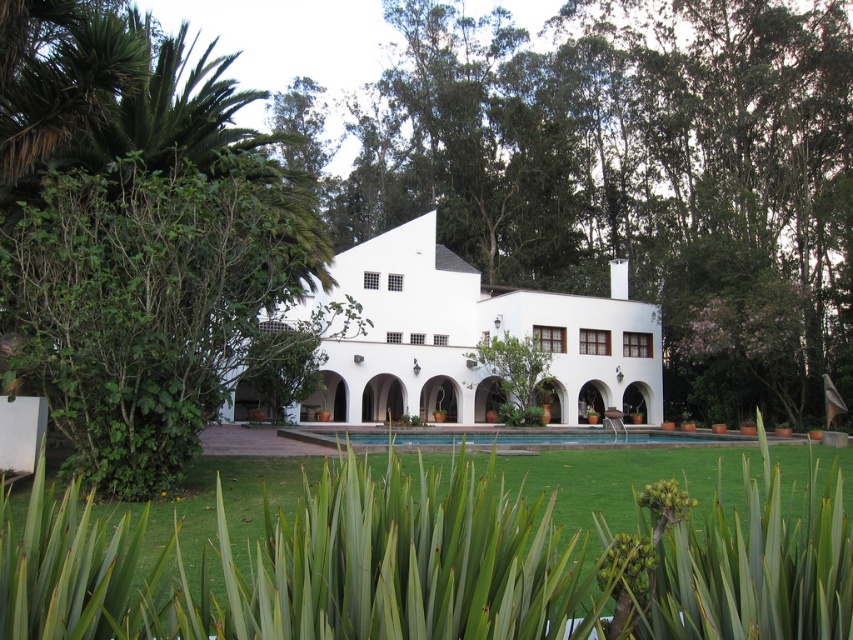
You are standing at the entrance of the modern white house and want to reach the swimming pool. There are two points marked in the yard. One is at point (583, 20) and the other is at point (335, 342). Which point is closer to the swimming pool?

Point (335, 342) is closer to the swimming pool because it is in front of point (583, 20), which is behind it.

You are standing in front of the modern white house and want to take a photo. There are two points marked in the scene, point 1 at coordinates point (105, 20) and point 2 at coordinates point (440, 369). Which point will appear larger in your photo?

Point 1 at coordinates point (105, 20) will appear larger in the photo because it is closer to the camera than point 2 at coordinates point (440, 369).